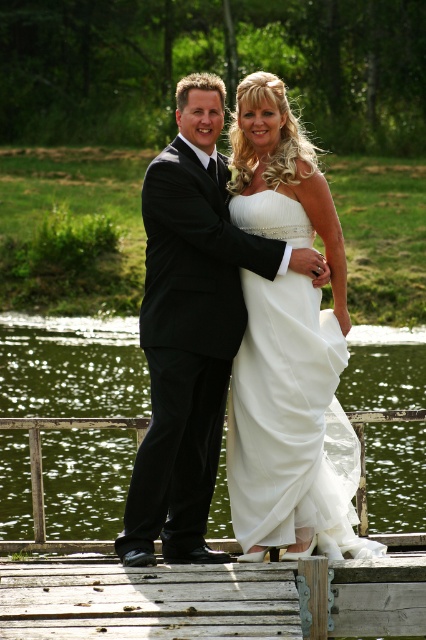
From the picture: Between green liquid water at center and white satin dress at center, which one has less height?

With less height is white satin dress at center.

Is point (5, 320) positioned in front of point (284, 198)?

That is False.

The height and width of the screenshot is (640, 426). Identify the location of green liquid water at center. (71, 365).

The width and height of the screenshot is (426, 640). Describe the element at coordinates (287, 348) in the screenshot. I see `matte black suit at center` at that location.

Is point (259, 188) positioned in front of point (264, 564)?

No, it is not.

The height and width of the screenshot is (640, 426). Identify the location of matte black suit at center. (287, 348).

Between green liquid water at center and wooden at center, which one has less height?

wooden at center is shorter.

Is point (144, 372) more distant than point (304, 588)?

Yes, it is behind point (304, 588).

Find the location of a particular element. green liquid water at center is located at coordinates (71, 365).